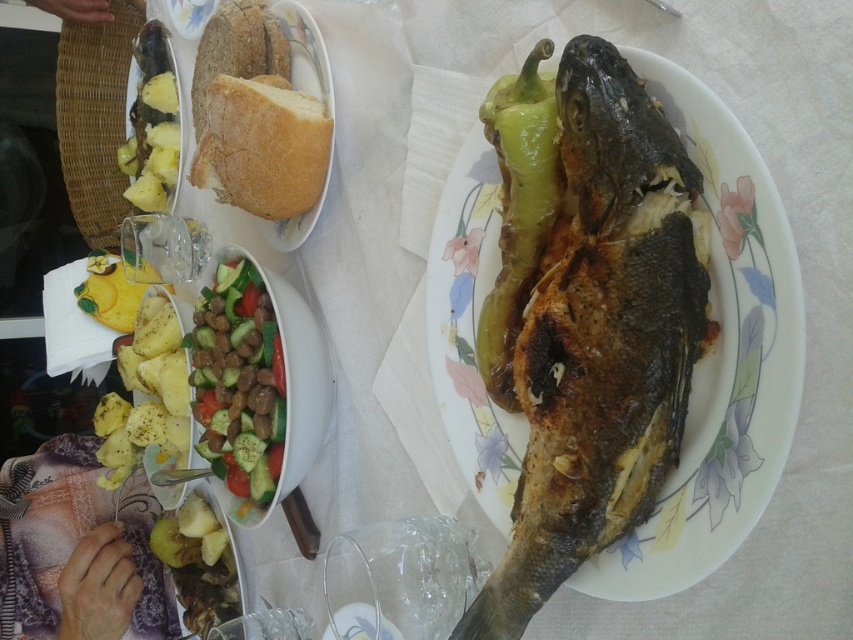
Between white soft bread at upper center and yellowish matte pineapple at left, which one has more height?

Standing taller between the two is yellowish matte pineapple at left.

Can you confirm if white soft bread at upper center is positioned above yellowish matte pineapple at left?

Incorrect, white soft bread at upper center is not positioned above yellowish matte pineapple at left.

Locate an element on the screen. white soft bread at upper center is located at coordinates (262, 147).

Can you confirm if brown crispy fish at center is positioned above sliced cucumber salad at center?

Indeed, brown crispy fish at center is positioned over sliced cucumber salad at center.

Which is in front, point (746, 216) or point (199, 298)?

Positioned in front is point (746, 216).

What are the coordinates of `brown crispy fish at center` in the screenshot? It's located at (718, 360).

Does sliced cucumber salad at center appear under bread at upper left?

Indeed, sliced cucumber salad at center is positioned under bread at upper left.

Between point (196, 346) and point (241, 3), which one is positioned behind?

The point (196, 346) is more distant.

Identify the location of sliced cucumber salad at center. (238, 381).